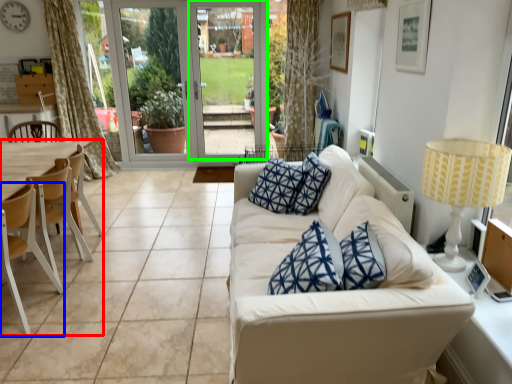
Question: Which object is positioned closest to armchair (highlighted by a red box)? Select from chair (highlighted by a blue box) and screen door (highlighted by a green box).

Choices:
 (A) chair
 (B) screen door

Answer: (A)